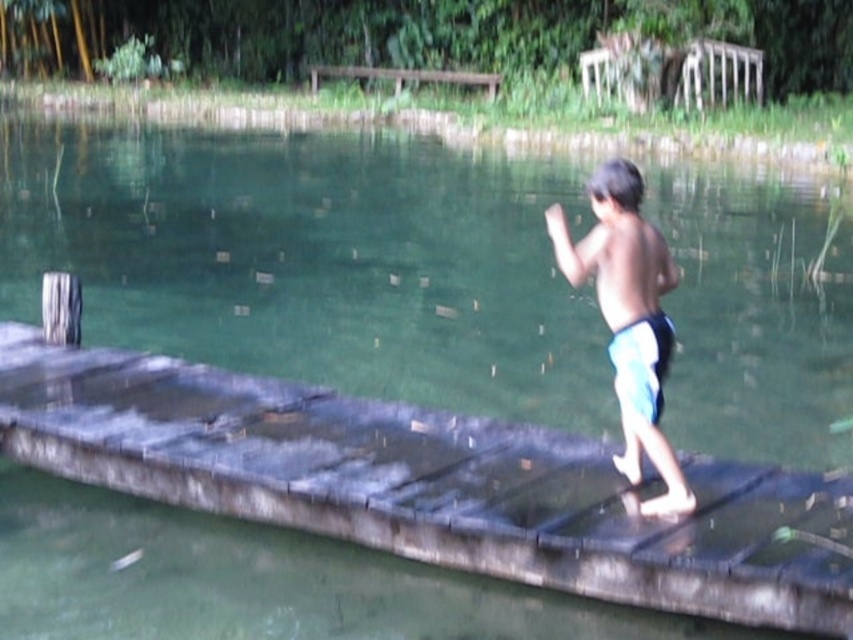
Does point (641, 326) come in front of point (465, 83)?

Yes, it is.

The image size is (853, 640). Find the location of `blue/white shorts at center`. blue/white shorts at center is located at coordinates (630, 317).

Where is `blue/white shorts at center`? blue/white shorts at center is located at coordinates (630, 317).